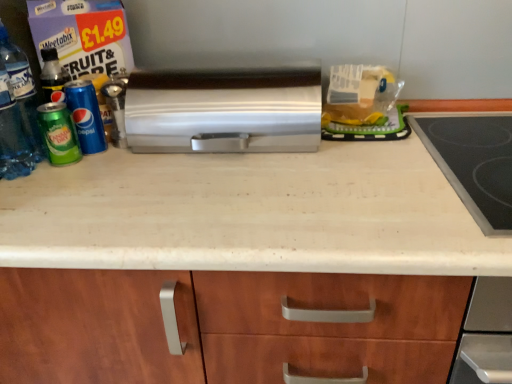
Where is `free space in front of translucent plastic bag at upper center`? free space in front of translucent plastic bag at upper center is located at coordinates (373, 154).